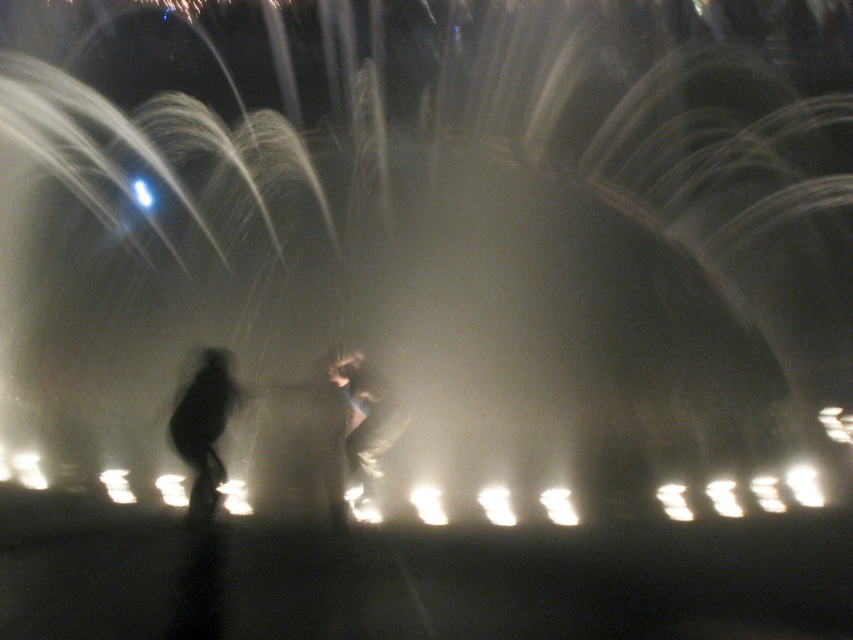
You are a photographer trying to capture a photo of both the silhouette figure at center and the black matte figure at left. Which figure will appear closer to the camera in the photo?

The silhouette figure at center will appear closer to the camera in the photo because it is positioned further to the viewer than the black matte figure at left.

Based on the photo, you are a photographer trying to capture the fountain scene. You notice two figures in the image, the silhouette figure at center and the black matte figure at left. Based on their positions, which figure is closer to the camera?

The silhouette figure at center is closer to the camera because it is positioned below the black matte figure at left, indicating it is in a lower plane relative to the viewer.